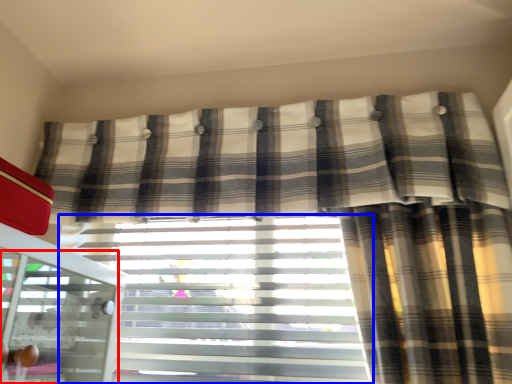
Question: Which object appears farthest to the camera in this image, screen door (highlighted by a red box) or window blind (highlighted by a blue box)?

Choices:
 (A) screen door
 (B) window blind

Answer: (B)